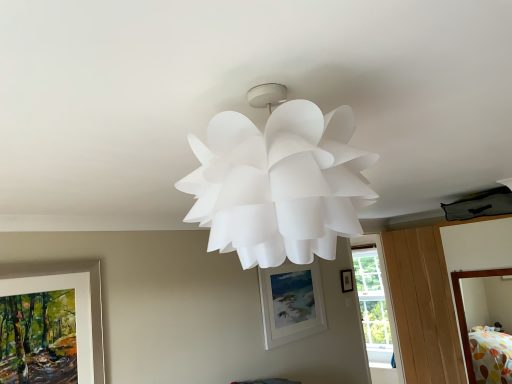
Question: From the image's perspective, relative to transparent glass window at center, is matte white picture frame at left, the 1th picture frame in the left-to-right sequence, above or below?

Choices:
 (A) below
 (B) above

Answer: (B)

Question: In terms of width, does matte white picture frame at left, the third picture frame when ordered from back to front, look wider or thinner when compared to transparent glass window at center?

Choices:
 (A) thin
 (B) wide

Answer: (A)

Question: Which object is positioned closest to the transparent glass window at center?

Choices:
 (A) polka dot fabric bed at lower right
 (B) matte white picture frame at left, which is the 1th picture frame in front-to-back order
 (C) matte black picture frame at upper center, which appears as the first picture frame when viewed from the back
 (D) white matte picture frame at center, arranged as the 2th picture frame when viewed from the right

Answer: (C)

Question: Which is farther from the matte white picture frame at left, the 1th picture frame in the left-to-right sequence?

Choices:
 (A) polka dot fabric bed at lower right
 (B) matte black picture frame at upper center, the 3th picture frame viewed from the front
 (C) transparent glass window at center
 (D) white matte picture frame at center, the 2th picture frame in the front-to-back sequence

Answer: (C)